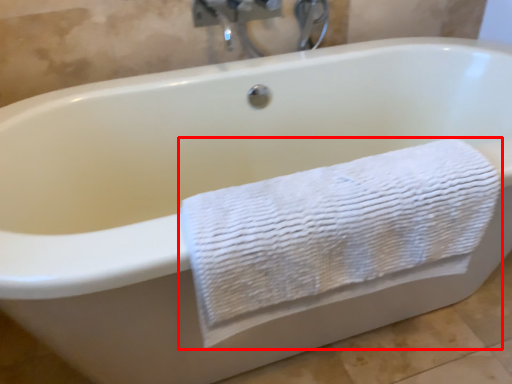
Question: Considering the relative positions of towel (annotated by the red box) and faucet in the image provided, where is towel (annotated by the red box) located with respect to the staircase?

Choices:
 (A) right
 (B) left

Answer: (B)